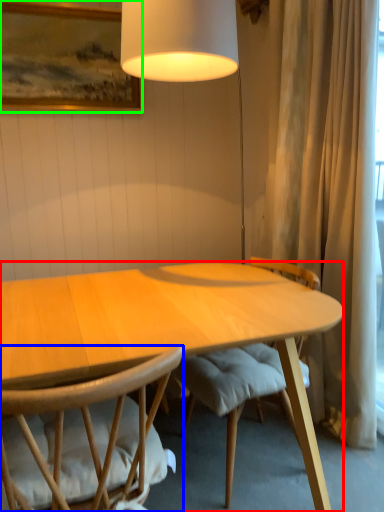
Question: Estimate the real-world distances between objects in this image. Which object is closer to desk (highlighted by a red box), chair (highlighted by a blue box) or picture frame (highlighted by a green box)?

Choices:
 (A) chair
 (B) picture frame

Answer: (A)